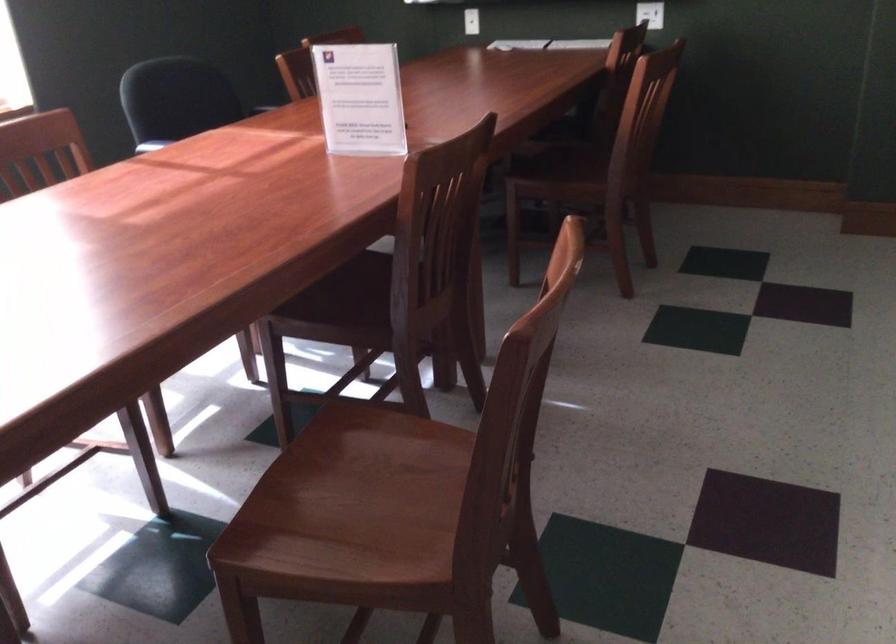
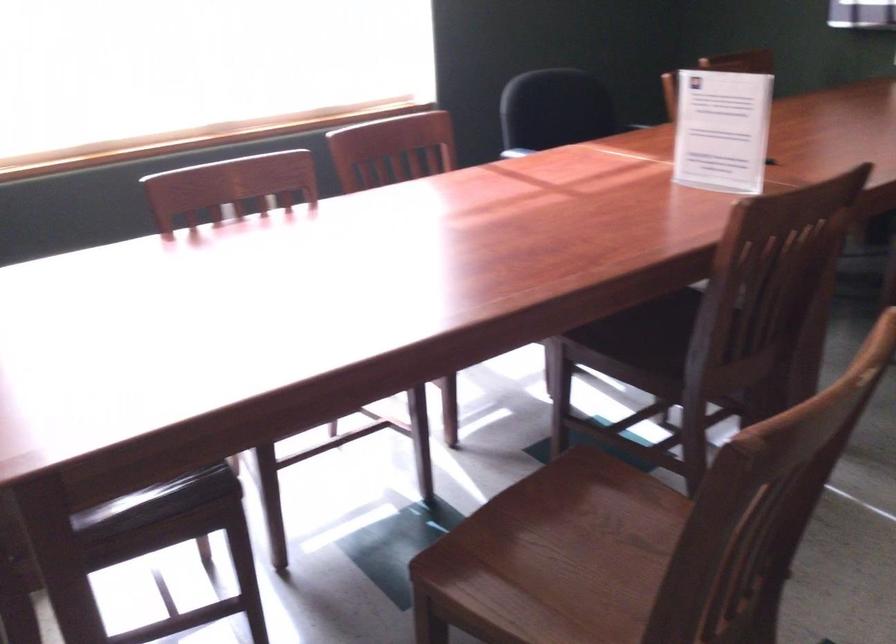
The images are taken continuously from a first-person perspective. In which direction are you moving?

The cameraman walked toward right, forward.